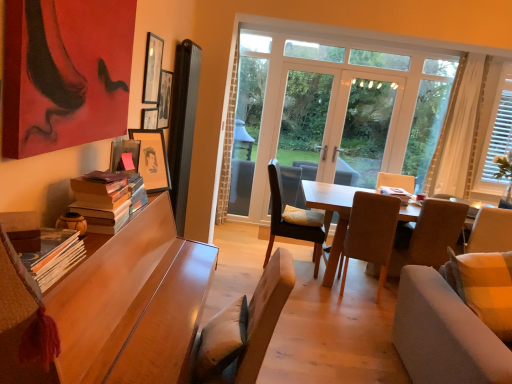
This screenshot has width=512, height=384. In order to click on vacant space situated above transparent glass door at center (from a real-world perspective) in this screenshot , I will do `click(316, 59)`.